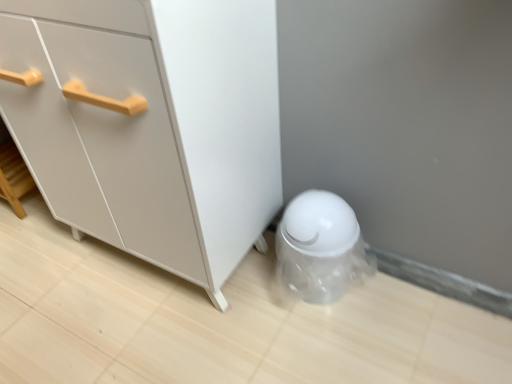
Where is `free space that is to the left of transparent plastic trash can at lower right`? The height and width of the screenshot is (384, 512). free space that is to the left of transparent plastic trash can at lower right is located at coordinates (254, 292).